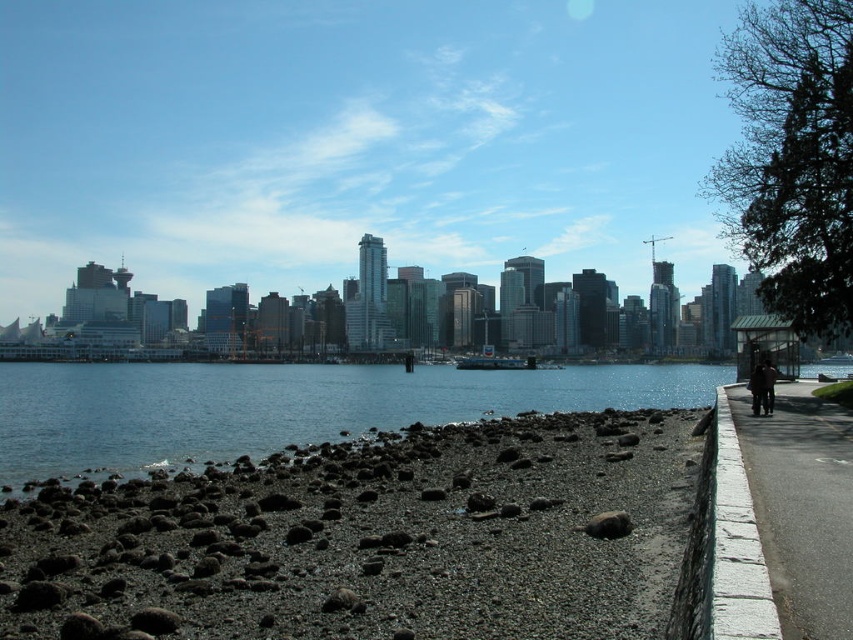
Question: Does clear blue water at lower left appear under asphalt pavement at right?

Choices:
 (A) no
 (B) yes

Answer: (B)

Question: Can you confirm if dark gray gravel at lower left is positioned above clear blue water at lower left?

Choices:
 (A) no
 (B) yes

Answer: (B)

Question: Is clear blue water at lower left below asphalt pavement at right?

Choices:
 (A) yes
 (B) no

Answer: (A)

Question: Which object is positioned farthest from the asphalt pavement at right?

Choices:
 (A) clear blue water at lower left
 (B) dark gray gravel at lower left

Answer: (A)

Question: Which point appears farthest from the camera in this image?

Choices:
 (A) (799, 524)
 (B) (292, 429)

Answer: (B)

Question: Which point appears farthest from the camera in this image?

Choices:
 (A) (828, 452)
 (B) (271, 384)
 (C) (598, 435)

Answer: (B)